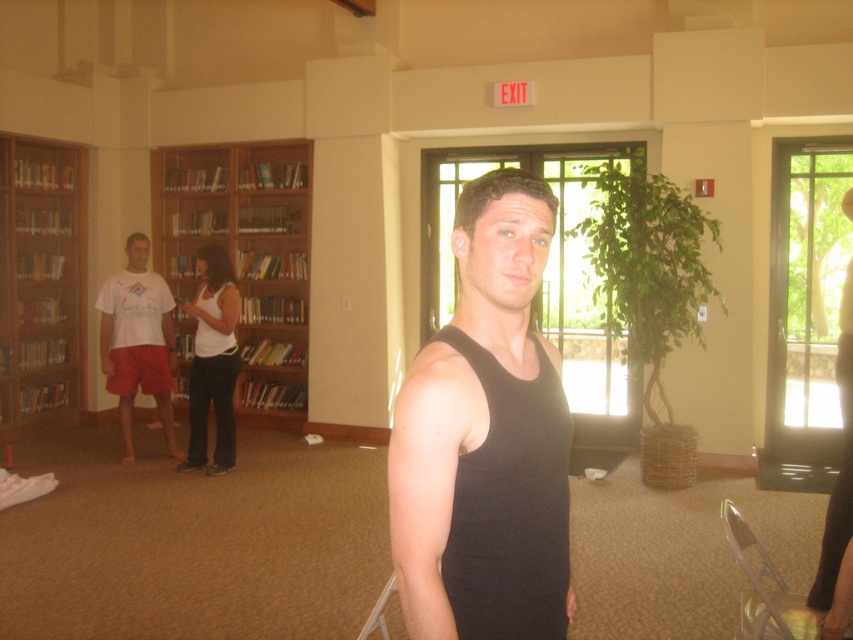
You are organizing books in a library and have two wooden bookcases. The wooden bookcase at center and the wooden bookcase at left. Which one has a larger size?

The wooden bookcase at center is bigger than the wooden bookcase at left, so the wooden bookcase at center has a larger size.